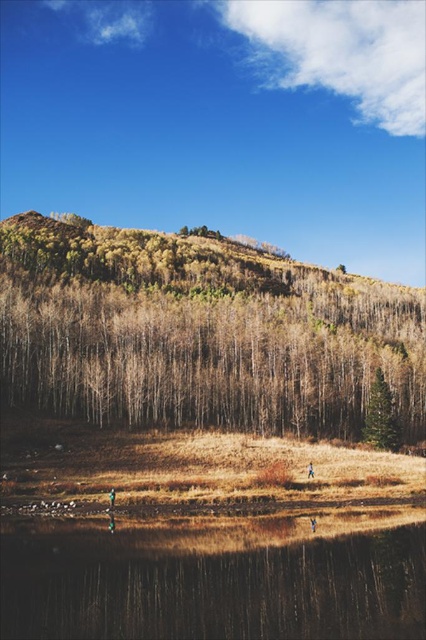
Question: Is green matte tree at right above brown leather jacket at lower center?

Choices:
 (A) yes
 (B) no

Answer: (A)

Question: Is brown textured trees at upper center below transparent glass water at lower center?

Choices:
 (A) yes
 (B) no

Answer: (B)

Question: Which object is closer to the camera taking this photo?

Choices:
 (A) transparent glass water at lower center
 (B) brown leather jacket at lower center
 (C) blue fabric person at lower center

Answer: (A)

Question: In this image, where is brown textured trees at upper center located relative to transparent glass water at lower center?

Choices:
 (A) above
 (B) below

Answer: (A)

Question: Considering the real-world distances, which object is farthest from the green matte tree at right?

Choices:
 (A) blue fabric person at lower center
 (B) brown textured trees at upper center

Answer: (B)

Question: Among these objects, which one is farthest from the camera?

Choices:
 (A) green matte tree at right
 (B) blue fabric person at lower center
 (C) brown leather jacket at lower center
 (D) transparent glass water at lower center

Answer: (A)